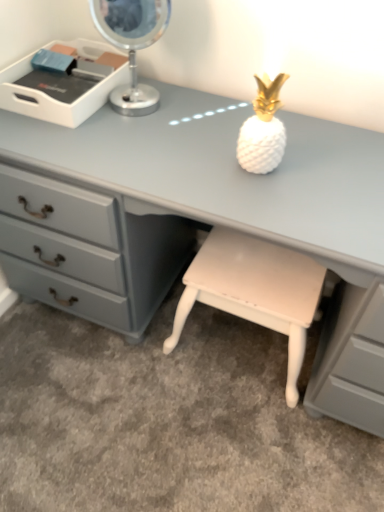
In order to click on vacant space in front of white plastic tray at upper left in this screenshot , I will do `click(72, 139)`.